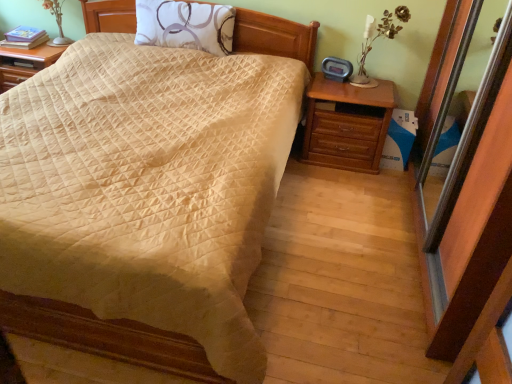
Question: Does white fabric pillow at upper center have a greater width compared to matte silver table lamp at upper left, the first table lamp in the back-to-front sequence?

Choices:
 (A) no
 (B) yes

Answer: (B)

Question: Does white fabric pillow at upper center contain matte silver table lamp at upper left, the first table lamp positioned from the top?

Choices:
 (A) yes
 (B) no

Answer: (B)

Question: Considering the relative positions of white fabric pillow at upper center and matte silver table lamp at upper left, arranged as the second table lamp when ordered from the bottom, in the image provided, is white fabric pillow at upper center to the left of matte silver table lamp at upper left, arranged as the second table lamp when ordered from the bottom, from the viewer's perspective?

Choices:
 (A) no
 (B) yes

Answer: (A)

Question: From the image's perspective, is white fabric pillow at upper center beneath matte silver table lamp at upper left, which appears as the second table lamp when viewed from the right?

Choices:
 (A) yes
 (B) no

Answer: (A)

Question: Is white fabric pillow at upper center next to matte silver table lamp at upper left, which appears as the first table lamp when viewed from the left?

Choices:
 (A) no
 (B) yes

Answer: (A)

Question: From a real-world perspective, is matte silver table lamp at upper left, arranged as the second table lamp when ordered from the bottom, physically located above or below white fabric pillow at upper center?

Choices:
 (A) above
 (B) below

Answer: (B)

Question: Relative to white fabric pillow at upper center, is matte silver table lamp at upper left, the first table lamp in the back-to-front sequence, in front or behind?

Choices:
 (A) front
 (B) behind

Answer: (B)

Question: From their relative heights in the image, would you say matte silver table lamp at upper left, the first table lamp positioned from the top, is taller or shorter than white fabric pillow at upper center?

Choices:
 (A) short
 (B) tall

Answer: (A)

Question: Choose the correct answer: Is matte silver table lamp at upper left, which appears as the first table lamp when viewed from the left, inside white fabric pillow at upper center or outside it?

Choices:
 (A) inside
 (B) outside

Answer: (B)

Question: Considering the positions of beige quilted bed at center and white ceramic table lamp at upper right, which is counted as the second table lamp, starting from the left, in the image, is beige quilted bed at center wider or thinner than white ceramic table lamp at upper right, which is counted as the second table lamp, starting from the left,?

Choices:
 (A) wide
 (B) thin

Answer: (A)

Question: In the image, is beige quilted bed at center positioned in front of or behind white ceramic table lamp at upper right, marked as the 1th table lamp in a right-to-left arrangement?

Choices:
 (A) front
 (B) behind

Answer: (A)

Question: Would you say beige quilted bed at center is to the left or to the right of white ceramic table lamp at upper right, the second table lamp from the top, in the picture?

Choices:
 (A) left
 (B) right

Answer: (A)

Question: Which is correct: beige quilted bed at center is inside white ceramic table lamp at upper right, the second table lamp from the top, or outside of it?

Choices:
 (A) inside
 (B) outside

Answer: (B)

Question: Is point (373, 39) positioned closer to the camera than point (177, 1)?

Choices:
 (A) farther
 (B) closer

Answer: (A)

Question: Is white ceramic table lamp at upper right, which is counted as the second table lamp, starting from the left, spatially inside white fabric pillow at upper center, or outside of it?

Choices:
 (A) inside
 (B) outside

Answer: (B)